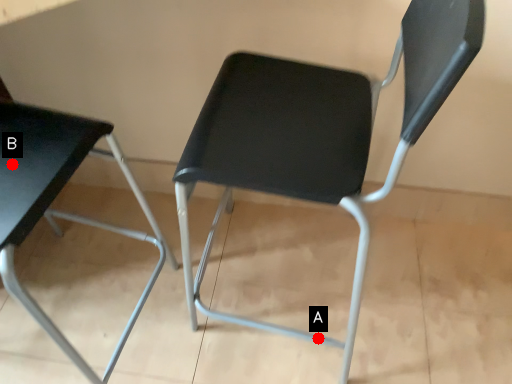
Question: Two points are circled on the image, labeled by A and B beside each circle. Which of the following is the closest to the observer?

Choices:
 (A) A is closer
 (B) B is closer

Answer: (B)